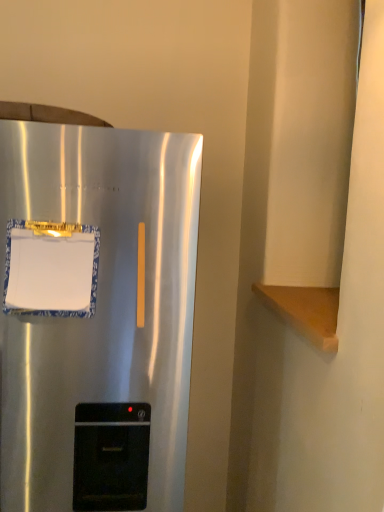
Question: Should I look upward or downward to see satin silver refrigerator at left?

Choices:
 (A) down
 (B) up

Answer: (A)

Question: Does white paper at left appear on the left side of satin silver refrigerator at left?

Choices:
 (A) no
 (B) yes

Answer: (A)

Question: From a real-world perspective, is white paper at left beneath satin silver refrigerator at left?

Choices:
 (A) yes
 (B) no

Answer: (B)

Question: Does white paper at left touch satin silver refrigerator at left?

Choices:
 (A) no
 (B) yes

Answer: (A)

Question: Is white paper at left taller than satin silver refrigerator at left?

Choices:
 (A) no
 (B) yes

Answer: (A)

Question: Considering the relative sizes of white paper at left and satin silver refrigerator at left in the image provided, is white paper at left thinner than satin silver refrigerator at left?

Choices:
 (A) no
 (B) yes

Answer: (B)

Question: From a real-world perspective, is white paper at left over satin silver refrigerator at left?

Choices:
 (A) yes
 (B) no

Answer: (A)

Question: Can you confirm if satin silver refrigerator at left is smaller than white paper at left?

Choices:
 (A) yes
 (B) no

Answer: (B)

Question: From a real-world perspective, is satin silver refrigerator at left physically above white paper at left?

Choices:
 (A) yes
 (B) no

Answer: (B)

Question: Could you tell me if satin silver refrigerator at left is turned towards white paper at left?

Choices:
 (A) no
 (B) yes

Answer: (B)

Question: Is satin silver refrigerator at left with white paper at left?

Choices:
 (A) no
 (B) yes

Answer: (A)

Question: Does satin silver refrigerator at left appear on the right side of white paper at left?

Choices:
 (A) yes
 (B) no

Answer: (B)

Question: Is satin silver refrigerator at left surrounding white paper at left?

Choices:
 (A) no
 (B) yes

Answer: (B)

Question: Considering the positions of satin silver refrigerator at left and white paper at left in the image, is satin silver refrigerator at left bigger or smaller than white paper at left?

Choices:
 (A) small
 (B) big

Answer: (B)